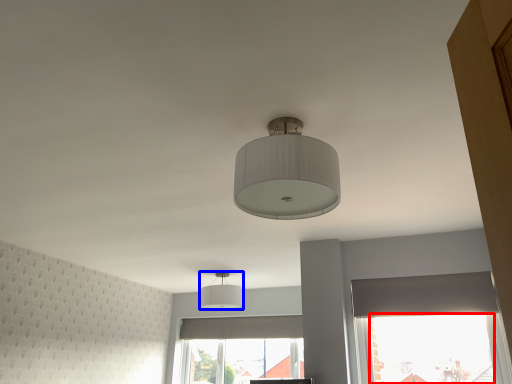
Question: Among these objects, which one is nearest to the camera, window screen (highlighted by a red box) or lamp (highlighted by a blue box)?

Choices:
 (A) window screen
 (B) lamp

Answer: (A)